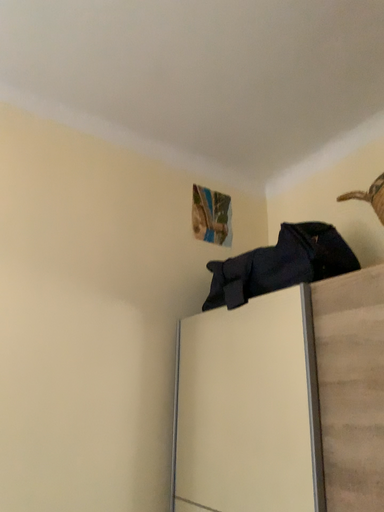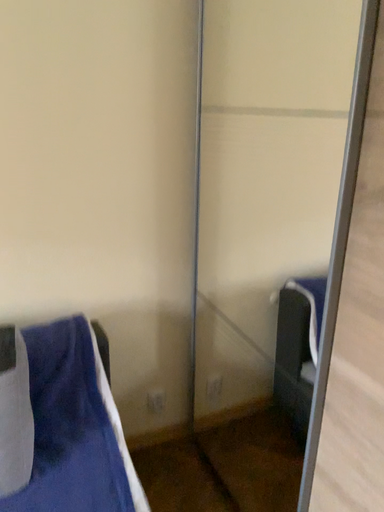
Question: How did the camera likely rotate when shooting the video?

Choices:
 (A) rotated downward
 (B) rotated upward

Answer: (A)